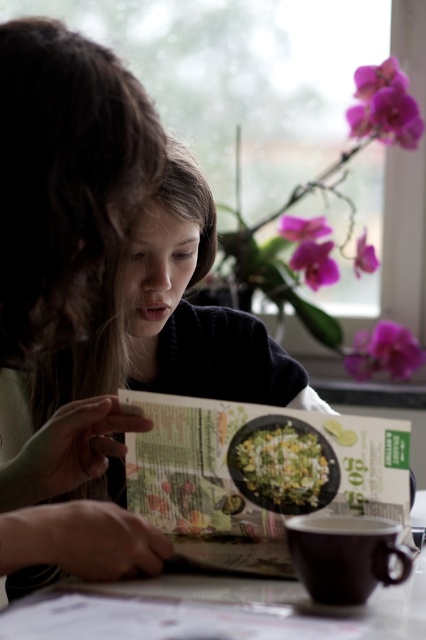
You are a librarian organizing books and flowers. You have a shelf that can only hold items up to 10 inches tall. You need to place the matte black book at center and the purple glossy orchid at upper right on the shelf. Can both items fit vertically on the shelf?

The matte black book at center is shorter than the purple glossy orchid at upper right. Since the shelf can only hold items up to 10 inches tall, both items can fit vertically on the shelf only if the tallest item, the purple glossy orchid at upper right, is under 10 inches. However, the exact height of the orchid isn

You are a delivery person who needs to place a small package between the purple glossy orchid at upper right and the green leafy vegetables at center. Can you fit the package in the space between them?

The distance between the purple glossy orchid at upper right and the green leafy vegetables at center is 4.23 feet, so the package can be placed in the space between them as there is enough room.

From the picture: You are designing a shelf to display both the matte black book at center and the purple glossy orchid at upper right. Which object requires a wider shelf space due to its size?

The purple glossy orchid at upper right requires a wider shelf space because it has a greater width than the matte black book at center.